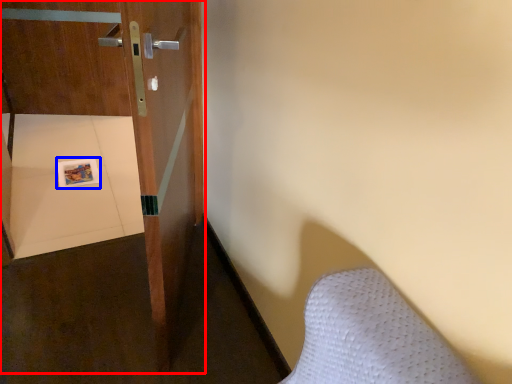
Question: Which object is closer to the camera taking this photo, door (highlighted by a red box) or copy (highlighted by a blue box)?

Choices:
 (A) door
 (B) copy

Answer: (A)